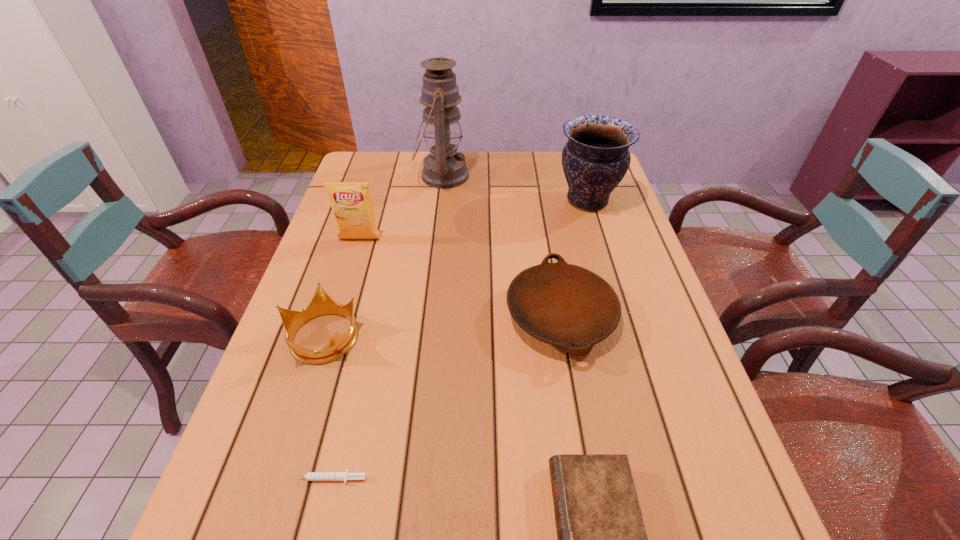
At what (x,y) coordinates should I click in order to perform the action: click on oil lamp. Please return your answer as a coordinate pair (x, y). Looking at the image, I should click on (444, 168).

You are a GUI agent. You are given a task and a screenshot of the screen. Output one action in this format:
    pyautogui.click(x=<x>, y=<y>)
    Task: Click on the second tallest object
    
    Given the screenshot: What is the action you would take?
    pyautogui.click(x=595, y=159)

I want to click on the third farthest object, so click(351, 203).

Identify the location of crisp (potato chip). The height and width of the screenshot is (540, 960). pyautogui.click(x=351, y=203).

The height and width of the screenshot is (540, 960). I want to click on crown, so [321, 304].

The width and height of the screenshot is (960, 540). I want to click on plate, so click(x=564, y=305).

The width and height of the screenshot is (960, 540). I want to click on syringe, so click(310, 476).

In order to click on vacant space located 0.270m on the front of the tallest object in this screenshot , I will do `click(434, 253)`.

I want to click on blank area located on the front handle of the sixth shortest object, so click(x=473, y=200).

Where is `free space located on the front handle of the sixth shortest object`? The image size is (960, 540). free space located on the front handle of the sixth shortest object is located at coordinates (441, 200).